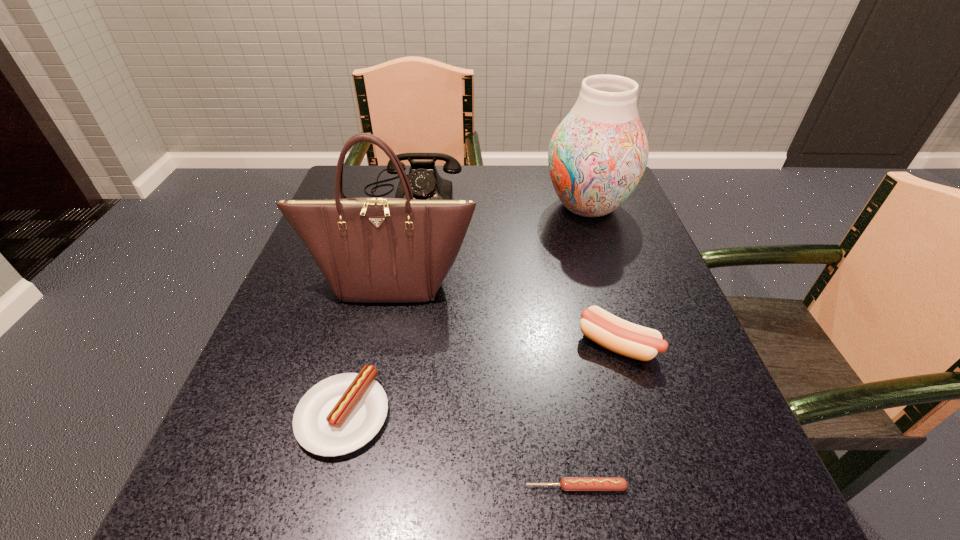
This screenshot has height=540, width=960. What are the coordinates of `vacant space situated on the front of the vase` in the screenshot? It's located at (621, 308).

In order to click on vacant space located 0.100m on the front face of the telephone in this screenshot , I will do `click(402, 241)`.

At what (x,y) coordinates should I click in order to perform the action: click on free location located on the front of the fourth farthest object. Please return your answer as a coordinate pair (x, y). This screenshot has width=960, height=540. Looking at the image, I should click on (655, 472).

The image size is (960, 540). I want to click on vacant space located on the right of the second tallest sausage, so click(573, 415).

In order to click on free space located 0.070m on the left of the shortest object in this screenshot , I will do `click(473, 487)`.

The image size is (960, 540). Identify the location of vase that is positioned at the far edge. (597, 155).

At what (x,y) coordinates should I click in order to perform the action: click on telephone at the far edge. Please return your answer as a coordinate pair (x, y). Looking at the image, I should click on (425, 182).

Locate an element on the screen. This screenshot has width=960, height=540. object at the near edge is located at coordinates (567, 483).

Where is `handbag that is positioned at the left edge`? This screenshot has width=960, height=540. handbag that is positioned at the left edge is located at coordinates (371, 249).

This screenshot has width=960, height=540. Identify the location of telephone located at the left edge. (425, 182).